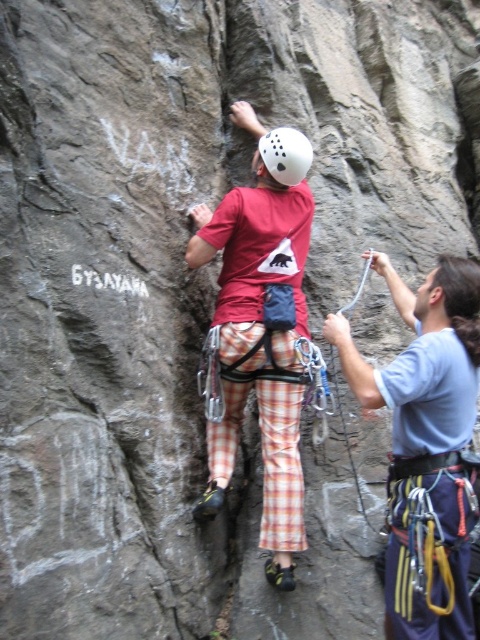
You are a safety inspector assessing the climbing setup. The recommended safety distance between the climber and the belayer is at least 5 meters to allow for proper rope management. Given the distance between the matte red shirt at center and the white matte helmet at center, is the current setup compliant with safety standards?

The matte red shirt at center is 4.82 meters from the white matte helmet at center. Since the required distance is at least 5 meters, the current setup does not comply with safety standards.

From the picture: You are the climber wearing the white matte helmet at center. You want to grab the blue fabric rope at right to adjust your position. Can you reach it without moving your current grip on the rock?

The blue fabric rope at right is in front of the white matte helmet at center, so yes, the climber can reach it without moving their grip since the rope is positioned closer to them.

You are the climber wearing the matte red shirt at center. You need to grab the blue fabric rope at right to adjust your position. Can you reach it without letting go of the rock?

The blue fabric rope at right is in front of the matte red shirt at center, so you can reach it without letting go of the rock.